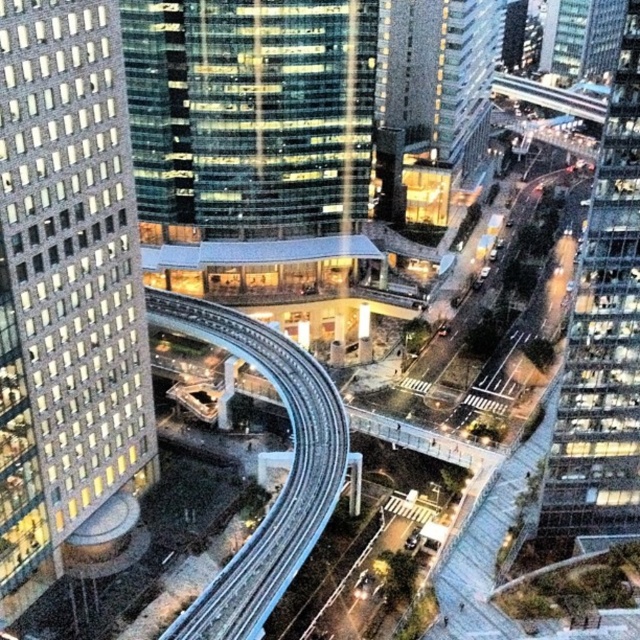
You are an architect analyzing the urban layout. Given the presence of the matte glass tower at left and the transparent glass skyscraper at right, which one would require more structural support due to its size?

The matte glass tower at left requires more structural support because it has a larger size compared to the transparent glass skyscraper at right.

You are an architect evaluating two skyscrapers in the city. The glassy reflective skyscraper at center and the transparent glass skyscraper at right. Which one would you recommend for a client who wants a building that appears more imposing from a distance?

The transparent glass skyscraper at right is taller than the glassy reflective skyscraper at center, so it would appear more imposing from a distance due to its greater height.

Based on the photo, you are a city planner evaluating the urban layout. Given the two skyscrapers in the scene, which one has a greater width? Please refer to the glassy reflective skyscraper at center and the transparent glass skyscraper at right in your answer.

The glassy reflective skyscraper at center has a greater width than the transparent glass skyscraper at right.